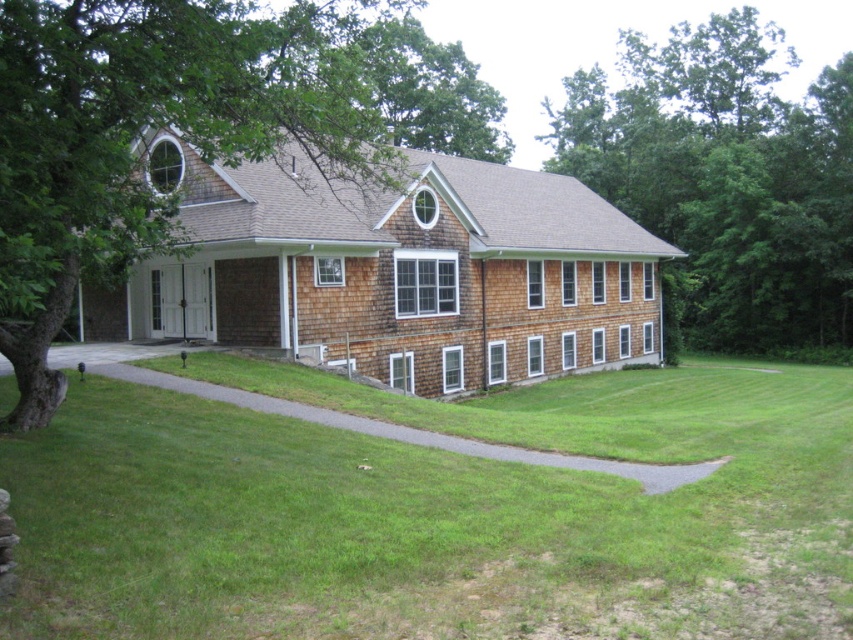
Question: Which object is farther from the camera taking this photo?

Choices:
 (A) green leafy tree at upper right
 (B) green grass at lower center

Answer: (A)

Question: Based on their relative distances, which object is farther from the green leafy tree at upper right?

Choices:
 (A) green grass at lower center
 (B) green leafy tree at left

Answer: (A)

Question: Which of the following is the farthest from the observer?

Choices:
 (A) (18, 595)
 (B) (770, 156)
 (C) (341, 161)

Answer: (B)

Question: Is green leafy tree at left bigger than green leafy tree at upper right?

Choices:
 (A) no
 (B) yes

Answer: (A)

Question: Does green grass at lower center appear on the left side of green leafy tree at upper right?

Choices:
 (A) no
 (B) yes

Answer: (B)

Question: Does green grass at lower center lie behind green leafy tree at left?

Choices:
 (A) no
 (B) yes

Answer: (A)